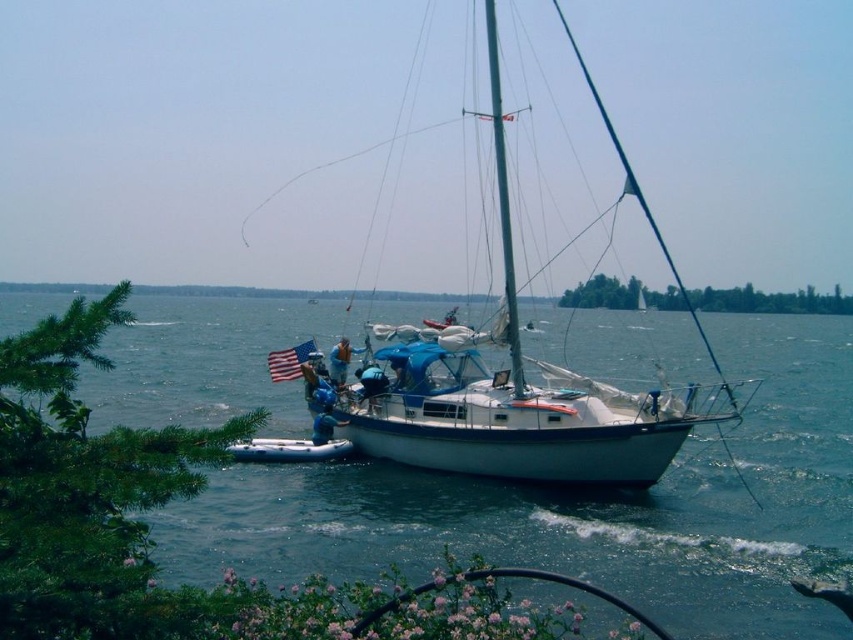
Question: Which object is positioned farthest from the blue water at center?

Choices:
 (A) american flag fabric at center
 (B) blue fabric at center
 (C) blue rubber boot at center

Answer: (B)

Question: Which point appears closest to the camera in this image?

Choices:
 (A) (380, 380)
 (B) (726, 356)
 (C) (317, 438)

Answer: (C)

Question: Does white rubber dinghy at lower center appear on the right side of blue rubber boot at center?

Choices:
 (A) no
 (B) yes

Answer: (A)

Question: Is white glossy sailboat at center below blue fabric at center?

Choices:
 (A) no
 (B) yes

Answer: (A)

Question: Which of these objects is positioned farthest from the blue rubber boot at center?

Choices:
 (A) white glossy sailboat at center
 (B) american flag fabric at center
 (C) blue fabric life vest at center

Answer: (A)

Question: Is blue rubber boot at center smaller than blue fabric at center?

Choices:
 (A) no
 (B) yes

Answer: (B)